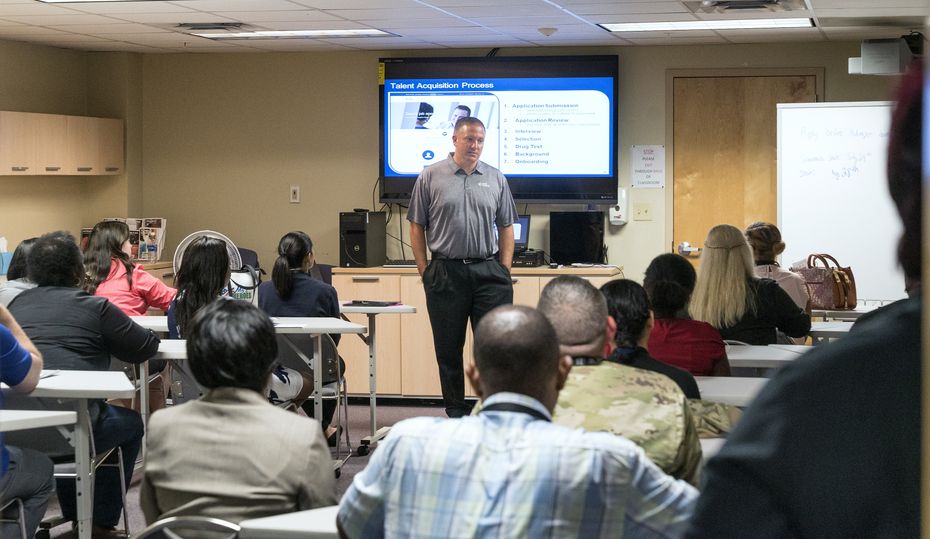
In order to click on cupboard in this screenshot , I will do `click(14, 160)`, `click(35, 143)`, `click(87, 143)`, `click(115, 144)`.